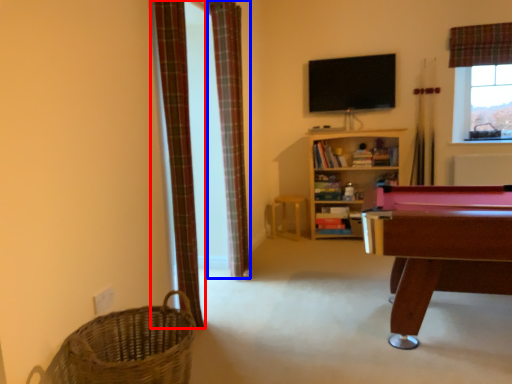
Question: Which of the following is the closest to the observer, curtain (highlighted by a red box) or curtain (highlighted by a blue box)?

Choices:
 (A) curtain
 (B) curtain

Answer: (A)